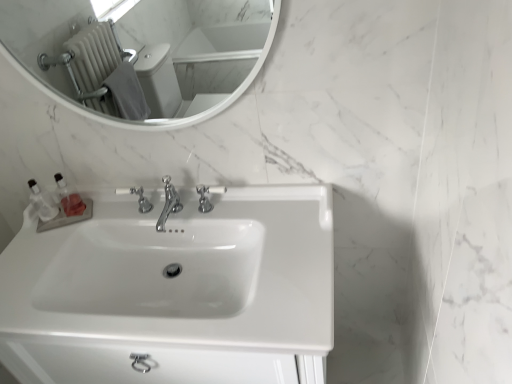
Question: Is white glossy mirror at upper center next to clear plastic bottles at left, which is the second toiletry from left to right?

Choices:
 (A) yes
 (B) no

Answer: (B)

Question: Can you confirm if white glossy mirror at upper center is bigger than clear plastic bottles at left, the 1th toiletry when ordered from right to left?

Choices:
 (A) yes
 (B) no

Answer: (A)

Question: From the image's perspective, is white glossy mirror at upper center below clear plastic bottles at left, the 1th toiletry when ordered from right to left?

Choices:
 (A) no
 (B) yes

Answer: (A)

Question: Is white glossy mirror at upper center positioned with its back to clear plastic bottles at left, the 1th toiletry when ordered from right to left?

Choices:
 (A) no
 (B) yes

Answer: (A)

Question: Considering the relative positions of white glossy mirror at upper center and clear plastic bottles at left, the 1th toiletry when ordered from right to left, in the image provided, is white glossy mirror at upper center to the left of clear plastic bottles at left, the 1th toiletry when ordered from right to left, from the viewer's perspective?

Choices:
 (A) yes
 (B) no

Answer: (B)

Question: Would you say polished chrome faucet at center, which appears as the second tap when viewed from the right, is inside or outside polished chrome faucet at center, positioned as the 1th tap in right-to-left order?

Choices:
 (A) inside
 (B) outside

Answer: (B)

Question: From their relative heights in the image, would you say polished chrome faucet at center, which appears as the second tap when viewed from the right, is taller or shorter than polished chrome faucet at center, the 3th tap positioned from the left?

Choices:
 (A) short
 (B) tall

Answer: (B)

Question: Looking at the image, does polished chrome faucet at center, which appears as the second tap when viewed from the right, seem bigger or smaller compared to polished chrome faucet at center, positioned as the 1th tap in right-to-left order?

Choices:
 (A) big
 (B) small

Answer: (A)

Question: Based on their positions, is polished chrome faucet at center, which appears as the second tap when viewed from the right, located to the left or right of polished chrome faucet at center, the 3th tap positioned from the left?

Choices:
 (A) right
 (B) left

Answer: (B)

Question: Relative to polished chrome faucet at center, which appears as the second tap when viewed from the right, is white glossy mirror at upper center in front or behind?

Choices:
 (A) front
 (B) behind

Answer: (A)

Question: Which is correct: white glossy mirror at upper center is inside polished chrome faucet at center, which appears as the second tap when viewed from the right, or outside of it?

Choices:
 (A) outside
 (B) inside

Answer: (A)

Question: From the image's perspective, is white glossy mirror at upper center located above or below polished chrome faucet at center, which appears as the second tap when viewed from the right?

Choices:
 (A) above
 (B) below

Answer: (A)

Question: From a real-world perspective, is white glossy mirror at upper center positioned above or below polished chrome faucet at center, which appears as the second tap when viewed from the right?

Choices:
 (A) below
 (B) above

Answer: (B)

Question: Is clear plastic bottles at left, the 1th toiletry from the left, to the left or to the right of chrome metallic faucet at center, which is the 3th tap in right-to-left order, in the image?

Choices:
 (A) right
 (B) left

Answer: (B)

Question: From a real-world perspective, is clear plastic bottles at left, which is the second toiletry in right-to-left order, physically located above or below chrome metallic faucet at center, acting as the first tap starting from the left?

Choices:
 (A) above
 (B) below

Answer: (A)